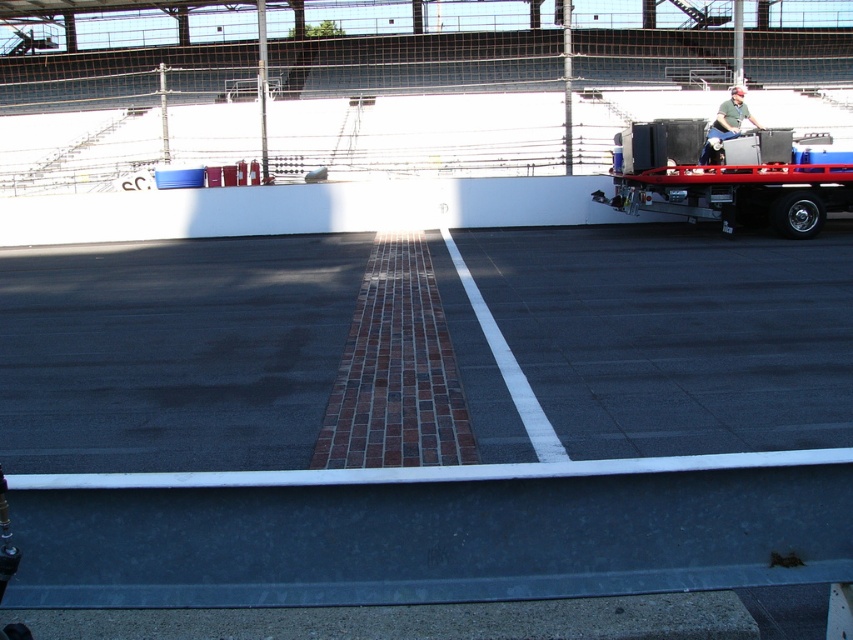
Question: Is metallic trailer at right positioned behind green matte shirt at upper right?

Choices:
 (A) no
 (B) yes

Answer: (A)

Question: Which point is closer to the camera?

Choices:
 (A) green matte shirt at upper right
 (B) metallic trailer at right

Answer: (B)

Question: Can you confirm if metallic trailer at right is thinner than green matte shirt at upper right?

Choices:
 (A) no
 (B) yes

Answer: (A)

Question: Does metallic trailer at right lie in front of green matte shirt at upper right?

Choices:
 (A) no
 (B) yes

Answer: (B)

Question: Which point is farther from the camera taking this photo?

Choices:
 (A) (755, 209)
 (B) (753, 122)

Answer: (A)